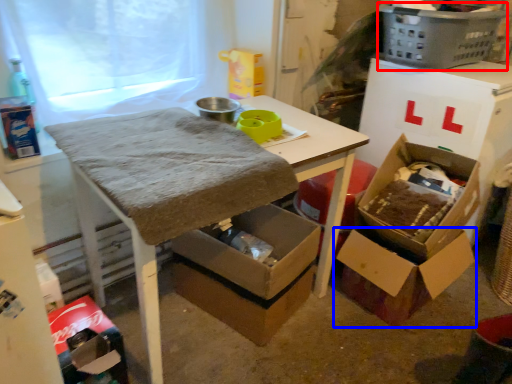
Question: Which point is closer to the camera, basket (highlighted by a red box) or box (highlighted by a blue box)?

Choices:
 (A) basket
 (B) box

Answer: (B)